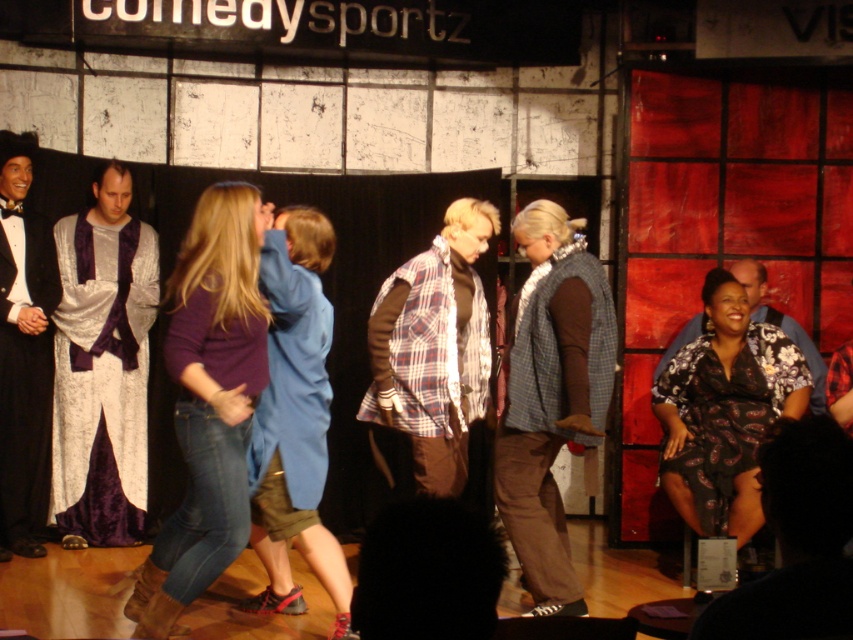
Question: Among these objects, which one is farthest from the camera?

Choices:
 (A) floral-patterned dress at center
 (B) velvet purple robe at left

Answer: (B)

Question: Considering the real-world distances, which object is closest to the plaid fabric shirt at center?

Choices:
 (A) velvet purple robe at left
 (B) plaid fabric vest at center
 (C) floral-patterned dress at center

Answer: (B)

Question: Is floral-patterned dress at center to the right of black velvet tuxedo at left from the viewer's perspective?

Choices:
 (A) no
 (B) yes

Answer: (B)

Question: Estimate the real-world distances between objects in this image. Which object is farther from the velvet purple robe at left?

Choices:
 (A) floral fabric shirt at right
 (B) matte purple sweater at center
 (C) plaid fabric shirt at center

Answer: (A)

Question: Does black velvet tuxedo at left come behind floral fabric shirt at right?

Choices:
 (A) yes
 (B) no

Answer: (B)

Question: Can you confirm if floral-patterned dress at center is bigger than black velvet tuxedo at left?

Choices:
 (A) yes
 (B) no

Answer: (A)